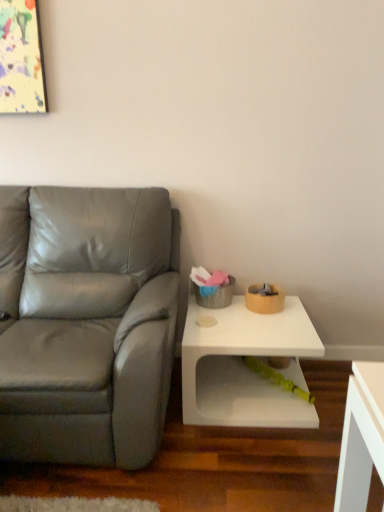
The height and width of the screenshot is (512, 384). What do you see at coordinates (88, 324) in the screenshot?
I see `matte gray leather couch at left` at bounding box center [88, 324].

This screenshot has height=512, width=384. What do you see at coordinates (276, 377) in the screenshot?
I see `rubberized green toy at lower center` at bounding box center [276, 377].

You are a GUI agent. You are given a task and a screenshot of the screen. Output one action in this format:
    pyautogui.click(x=<x>, y=<y>)
    Task: Click on the white matte table at lower right
    This screenshot has height=512, width=384.
    Given the screenshot: What is the action you would take?
    pyautogui.click(x=245, y=367)

Consider the image. How many degrees apart are the facing directions of white matte table at lower right and matte gray leather couch at left?

0.000138 degrees.

Considering the sizes of objects white matte table at lower right and matte gray leather couch at left in the image provided, who is smaller, white matte table at lower right or matte gray leather couch at left?

With smaller size is white matte table at lower right.

Considering the positions of objects white matte table at lower right and matte gray leather couch at left in the image provided, who is in front, white matte table at lower right or matte gray leather couch at left?

matte gray leather couch at left.

Based on the photo, does white matte table at lower right have a greater width compared to matte gray leather couch at left?

In fact, white matte table at lower right might be narrower than matte gray leather couch at left.

This screenshot has width=384, height=512. I want to click on studio couch located on the left of rubberized green toy at lower center, so click(x=88, y=324).

Are matte gray leather couch at left and rubberized green toy at lower center making contact?

There is a gap between matte gray leather couch at left and rubberized green toy at lower center.

From a real-world perspective, is matte gray leather couch at left physically below rubberized green toy at lower center?

No, from a real-world perspective, matte gray leather couch at left is not below rubberized green toy at lower center.

Considering the relative sizes of rubberized green toy at lower center and white matte table at lower right in the image provided, is rubberized green toy at lower center shorter than white matte table at lower right?

Yes, rubberized green toy at lower center is shorter than white matte table at lower right.

Which of these two, rubberized green toy at lower center or white matte table at lower right, is wider?

With larger width is white matte table at lower right.

Could you tell me if rubberized green toy at lower center is turned towards white matte table at lower right?

Yes, rubberized green toy at lower center is oriented towards white matte table at lower right.

From a real-world perspective, does rubberized green toy at lower center stand above matte gray leather couch at left?

No, from a real-world perspective, rubberized green toy at lower center is not on top of matte gray leather couch at left.

Between rubberized green toy at lower center and matte gray leather couch at left, which one has larger size?

Bigger between the two is matte gray leather couch at left.

Would you say rubberized green toy at lower center is a long distance from matte gray leather couch at left?

That's not correct — rubberized green toy at lower center is a little close to matte gray leather couch at left.

Is rubberized green toy at lower center taller or shorter than matte gray leather couch at left?

rubberized green toy at lower center is shorter than matte gray leather couch at left.

Are matte gray leather couch at left and white matte table at lower right making contact?

matte gray leather couch at left and white matte table at lower right are not in contact.

Which of these two, matte gray leather couch at left or white matte table at lower right, is smaller?

white matte table at lower right.

From the picture: Which is behind, matte gray leather couch at left or white matte table at lower right?

white matte table at lower right is further away from the camera.

From the picture: What's the angular difference between matte gray leather couch at left and white matte table at lower right's facing directions?

There is a 0.000138-degree angle between the facing directions of matte gray leather couch at left and white matte table at lower right.

Which object is positioned more to the left, white matte table at lower right or rubberized green toy at lower center?

white matte table at lower right.

Is rubberized green toy at lower center at the back of white matte table at lower right?

white matte table at lower right is not turned away from rubberized green toy at lower center.

In terms of height, does white matte table at lower right look taller or shorter compared to rubberized green toy at lower center?

Considering their sizes, white matte table at lower right has more height than rubberized green toy at lower center.

Identify the location of table behind the matte gray leather couch at left. The width and height of the screenshot is (384, 512). (245, 367).

Image resolution: width=384 pixels, height=512 pixels. What are the coordinates of `toy that is below the matte gray leather couch at left (from the image's perspective)` in the screenshot? It's located at (276, 377).

From the image, which object appears to be nearer to matte gray leather couch at left, rubberized green toy at lower center or white matte table at lower right?

Among the two, white matte table at lower right is located nearer to matte gray leather couch at left.

Considering their positions, is rubberized green toy at lower center positioned further to white matte table at lower right than matte gray leather couch at left?

Based on the image, matte gray leather couch at left appears to be further to white matte table at lower right.

Considering their positions, is matte gray leather couch at left positioned further to rubberized green toy at lower center than white matte table at lower right?

matte gray leather couch at left.

Looking at the image, which one is located closer to rubberized green toy at lower center, white matte table at lower right or matte gray leather couch at left?

Based on the image, white matte table at lower right appears to be nearer to rubberized green toy at lower center.

Looking at the image, which one is located closer to white matte table at lower right, matte gray leather couch at left or rubberized green toy at lower center?

rubberized green toy at lower center is closer to white matte table at lower right.

From the image, which object appears to be nearer to matte gray leather couch at left, white matte table at lower right or rubberized green toy at lower center?

The object closer to matte gray leather couch at left is white matte table at lower right.

The image size is (384, 512). In order to click on table between matte gray leather couch at left and rubberized green toy at lower center in this screenshot , I will do `click(245, 367)`.